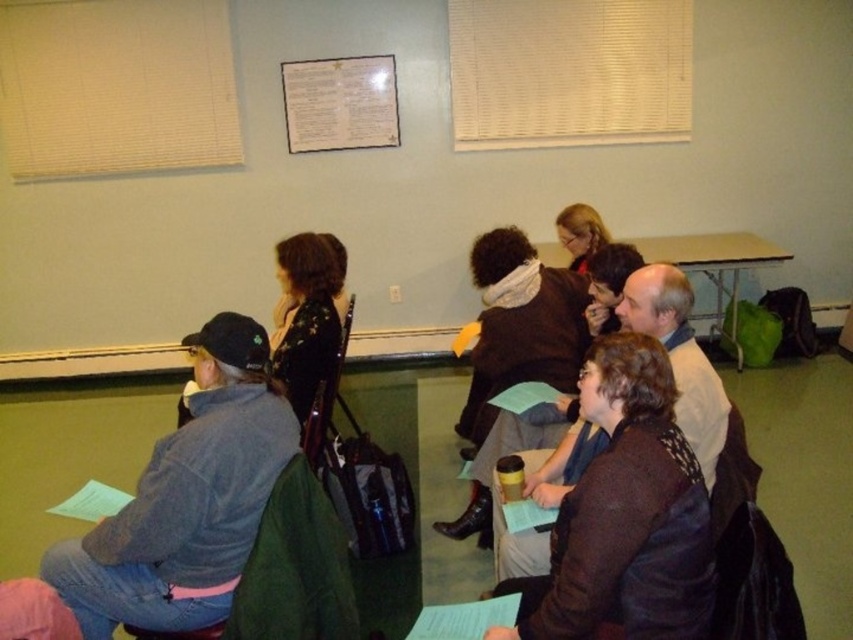
Which is behind, point (633, 563) or point (604, 228)?

Point (604, 228)

Is brown fuzzy sweater at center bigger than matte black jacket at center?

Yes.

The image size is (853, 640). What do you see at coordinates (628, 513) in the screenshot? I see `brown fuzzy sweater at center` at bounding box center [628, 513].

Find the location of a particular element. brown fuzzy sweater at center is located at coordinates (628, 513).

Is floral-patterned fabric at center taller than matte black jacket at center?

Correct, floral-patterned fabric at center is much taller as matte black jacket at center.

Does floral-patterned fabric at center lie in front of matte black jacket at center?

Yes, it is in front of matte black jacket at center.

Identify the location of floral-patterned fabric at center. This screenshot has width=853, height=640. (306, 316).

Can you confirm if brown fuzzy sweater at center is shorter than floral-patterned fabric at center?

Yes.

The width and height of the screenshot is (853, 640). I want to click on brown fuzzy sweater at center, so click(628, 513).

Does point (602, 557) lie in front of point (293, 369)?

Yes, it is.

At what (x,y) coordinates should I click in order to perform the action: click on brown fuzzy sweater at center. Please return your answer as a coordinate pair (x, y). Image resolution: width=853 pixels, height=640 pixels. Looking at the image, I should click on (628, 513).